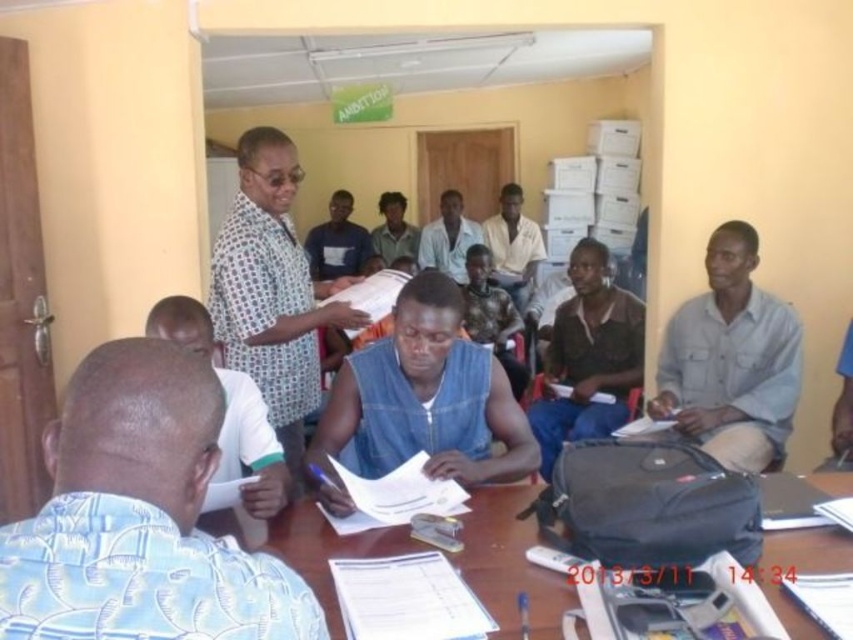
Which is more to the right, patterned fabric shirt at center or brown textured shirt at center?

brown textured shirt at center

Is patterned fabric shirt at center behind brown textured shirt at center?

No, patterned fabric shirt at center is in front of brown textured shirt at center.

What do you see at coordinates (271, 291) in the screenshot?
I see `patterned fabric shirt at center` at bounding box center [271, 291].

The width and height of the screenshot is (853, 640). I want to click on patterned fabric shirt at center, so click(x=271, y=291).

Can you confirm if denim vest at center is positioned above light brown fabric shirt at center?

Incorrect, denim vest at center is not positioned above light brown fabric shirt at center.

Is point (494, 417) positioned behind point (374, 244)?

No, (494, 417) is in front of (374, 244).

Where is `denim vest at center`? The height and width of the screenshot is (640, 853). denim vest at center is located at coordinates (425, 397).

This screenshot has height=640, width=853. What do you see at coordinates (425, 397) in the screenshot? I see `denim vest at center` at bounding box center [425, 397].

Is denim vest at center smaller than wooden table at center?

Actually, denim vest at center might be larger than wooden table at center.

Between point (450, 410) and point (506, 618), which one is positioned in front?

Point (506, 618) is in front.

You are a GUI agent. You are given a task and a screenshot of the screen. Output one action in this format:
    pyautogui.click(x=<x>, y=<y>)
    Task: Click on the denim vest at center
    
    Given the screenshot: What is the action you would take?
    pyautogui.click(x=425, y=397)